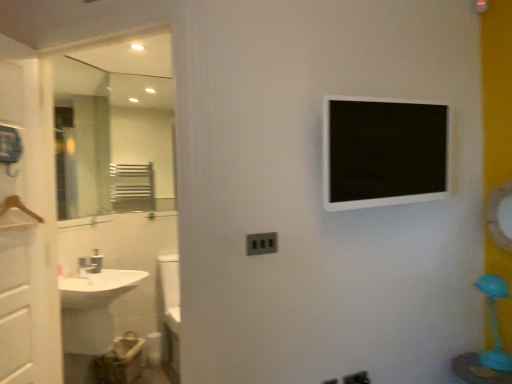
At what (x,y) coordinates should I click in order to perform the action: click on glossy metallic mirror at upper right. Please return your answer as a coordinate pair (x, y). Image resolution: width=512 pixels, height=384 pixels. Looking at the image, I should click on (498, 215).

This screenshot has width=512, height=384. Describe the element at coordinates (498, 215) in the screenshot. I see `glossy metallic mirror at upper right` at that location.

Measure the distance between point (25, 99) and camera.

Point (25, 99) and camera are 6.25 feet apart from each other.

This screenshot has height=384, width=512. What are the coordinates of `matte gray electric outlet at center` in the screenshot? It's located at (261, 243).

This screenshot has height=384, width=512. What do you see at coordinates (93, 308) in the screenshot?
I see `white glossy sink at lower left` at bounding box center [93, 308].

Where is `glossy metallic mirror at upper right`? This screenshot has width=512, height=384. glossy metallic mirror at upper right is located at coordinates (498, 215).

Could you tell me if white glossy screen door at left is turned towards matte gray electric outlet at center?

Yes, white glossy screen door at left is aimed at matte gray electric outlet at center.

From their relative heights in the image, would you say white glossy screen door at left is taller or shorter than matte gray electric outlet at center?

white glossy screen door at left is taller than matte gray electric outlet at center.

In the image, is white glossy screen door at left on the left side or the right side of matte gray electric outlet at center?

white glossy screen door at left is positioned on matte gray electric outlet at center's left side.

How much distance is there between white glossy screen door at left and matte gray electric outlet at center?

They are 3.68 feet apart.

Consider the image. Is white glossy screen door at left facing towards glossy metallic mirror at upper right?

Yes, white glossy screen door at left is aimed at glossy metallic mirror at upper right.

Consider the image. From the image's perspective, is white glossy screen door at left above or below glossy metallic mirror at upper right?

white glossy screen door at left is situated lower than glossy metallic mirror at upper right in the image.

Which object is closer to the camera, white glossy screen door at left or glossy metallic mirror at upper right?

white glossy screen door at left is in front.

Looking at their sizes, would you say white glossy screen door at left is wider or thinner than glossy metallic mirror at upper right?

In the image, white glossy screen door at left appears to be more narrow than glossy metallic mirror at upper right.

Find the location of a particular element. screen door below the glossy metallic mirror at upper right (from the image's perspective) is located at coordinates (29, 230).

Considering the sizes of objects glossy metallic mirror at upper right and white glossy screen door at left in the image provided, who is taller, glossy metallic mirror at upper right or white glossy screen door at left?

With more height is white glossy screen door at left.

Between glossy metallic mirror at upper right and white glossy screen door at left, which one has larger width?

glossy metallic mirror at upper right is wider.

Measure the distance from glossy metallic mirror at upper right to white glossy screen door at left.

glossy metallic mirror at upper right is 2.37 meters from white glossy screen door at left.

Can you tell me how much white glossy sink at lower left and matte gray electric outlet at center differ in facing direction?

39.3 degrees.

Considering the relative sizes of white glossy sink at lower left and matte gray electric outlet at center in the image provided, is white glossy sink at lower left shorter than matte gray electric outlet at center?

In fact, white glossy sink at lower left may be taller than matte gray electric outlet at center.

Which of these two, white glossy sink at lower left or matte gray electric outlet at center, is thinner?

matte gray electric outlet at center.

Visually, is white glossy sink at lower left positioned to the left or to the right of matte gray electric outlet at center?

white glossy sink at lower left is to the left of matte gray electric outlet at center.

In the image, is matte gray electric outlet at center on the left side or the right side of white glossy sink at lower left?

Clearly, matte gray electric outlet at center is on the right of white glossy sink at lower left in the image.

In the scene shown: Which of these two, matte gray electric outlet at center or white glossy sink at lower left, is smaller?

With smaller size is matte gray electric outlet at center.

Considering the relative sizes of matte gray electric outlet at center and white glossy sink at lower left in the image provided, is matte gray electric outlet at center taller than white glossy sink at lower left?

No.

Does point (251, 235) appear closer or farther from the camera than point (113, 326)?

Clearly, point (251, 235) is closer to the camera than point (113, 326).

Based on the photo, between white glossy sink at lower left and white glossy medicine cabinet at upper center, which one has more height?

Standing taller between the two is white glossy sink at lower left.

From the image's perspective, does white glossy sink at lower left appear lower than white glossy medicine cabinet at upper center?

Correct, white glossy sink at lower left appears lower than white glossy medicine cabinet at upper center in the image.

Considering the relative sizes of white glossy sink at lower left and white glossy medicine cabinet at upper center in the image provided, is white glossy sink at lower left wider than white glossy medicine cabinet at upper center?

Yes.

From a real-world perspective, is white glossy sink at lower left physically located above or below white glossy medicine cabinet at upper center?

From a real-world perspective, white glossy sink at lower left is physically below white glossy medicine cabinet at upper center.

Can you see glossy metallic mirror at upper right touching white glossy medicine cabinet at upper center?

There is a gap between glossy metallic mirror at upper right and white glossy medicine cabinet at upper center.

Does point (493, 190) come farther from viewer compared to point (383, 125)?

Yes, point (493, 190) is farther from viewer.

Considering the sizes of objects glossy metallic mirror at upper right and white glossy medicine cabinet at upper center in the image provided, who is shorter, glossy metallic mirror at upper right or white glossy medicine cabinet at upper center?

glossy metallic mirror at upper right is shorter.

From the image's perspective, would you say glossy metallic mirror at upper right is positioned over white glossy medicine cabinet at upper center?

No, from the image's perspective, glossy metallic mirror at upper right is not on top of white glossy medicine cabinet at upper center.

The width and height of the screenshot is (512, 384). Identify the location of electric outlet below the white glossy screen door at left (from a real-world perspective). (261, 243).

You are a GUI agent. You are given a task and a screenshot of the screen. Output one action in this format:
    pyautogui.click(x=<x>, y=<y>)
    Task: Click on the screen door below the glossy metallic mirror at upper right (from the image's perspective)
    The height and width of the screenshot is (384, 512).
    Given the screenshot: What is the action you would take?
    pyautogui.click(x=29, y=230)

Which object lies further to the anchor point matte gray electric outlet at center, white glossy screen door at left or glossy metallic mirror at upper right?

Among the two, glossy metallic mirror at upper right is located further to matte gray electric outlet at center.

Looking at the image, which one is located further to white glossy medicine cabinet at upper center, glossy metallic mirror at upper right or white glossy screen door at left?

Based on the image, white glossy screen door at left appears to be further to white glossy medicine cabinet at upper center.

Estimate the real-world distances between objects in this image. Which object is further from glossy metallic mirror at upper right, white glossy medicine cabinet at upper center or matte gray electric outlet at center?

matte gray electric outlet at center is further to glossy metallic mirror at upper right.

Consider the image. Which object lies further to the anchor point white glossy screen door at left, matte gray electric outlet at center or white glossy sink at lower left?

Among the two, matte gray electric outlet at center is located further to white glossy screen door at left.

Considering their positions, is glossy metallic mirror at upper right positioned closer to white glossy screen door at left than matte gray electric outlet at center?

Based on the image, matte gray electric outlet at center appears to be nearer to white glossy screen door at left.

Based on their spatial positions, is white glossy screen door at left or matte gray electric outlet at center further from glossy metallic mirror at upper right?

white glossy screen door at left is positioned further to the anchor glossy metallic mirror at upper right.

When comparing their distances from white glossy medicine cabinet at upper center, does white glossy sink at lower left or white glossy screen door at left seem further?

white glossy sink at lower left.

Based on their spatial positions, is white glossy sink at lower left or glossy metallic mirror at upper right further from matte gray electric outlet at center?

white glossy sink at lower left is positioned further to the anchor matte gray electric outlet at center.

Where is `sink between white glossy screen door at left and glossy metallic mirror at upper right`? sink between white glossy screen door at left and glossy metallic mirror at upper right is located at coordinates (93, 308).

Locate an element on the screen. This screenshot has width=512, height=384. electric outlet located between white glossy screen door at left and white glossy medicine cabinet at upper center in the left-right direction is located at coordinates (261, 243).

Locate an element on the screen. electric outlet between white glossy sink at lower left and white glossy medicine cabinet at upper center is located at coordinates (261, 243).

I want to click on electric outlet between white glossy screen door at left and glossy metallic mirror at upper right in the horizontal direction, so click(x=261, y=243).